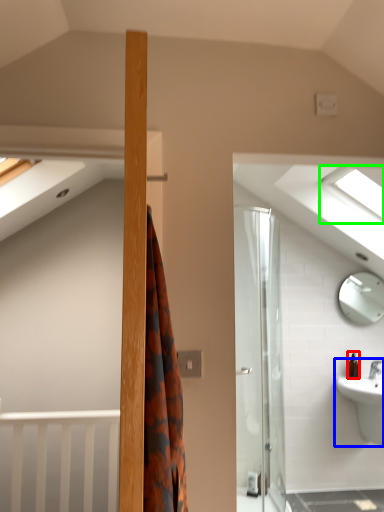
Question: Based on their relative distances, which object is nearer to toiletry (highlighted by a red box)? Choose from sink (highlighted by a blue box) and window (highlighted by a green box).

Choices:
 (A) sink
 (B) window

Answer: (A)